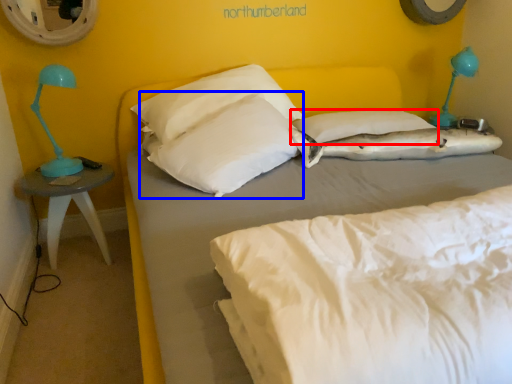
Question: Which of the following is the farthest to the observer, pillow (highlighted by a red box) or pillow (highlighted by a blue box)?

Choices:
 (A) pillow
 (B) pillow

Answer: (A)